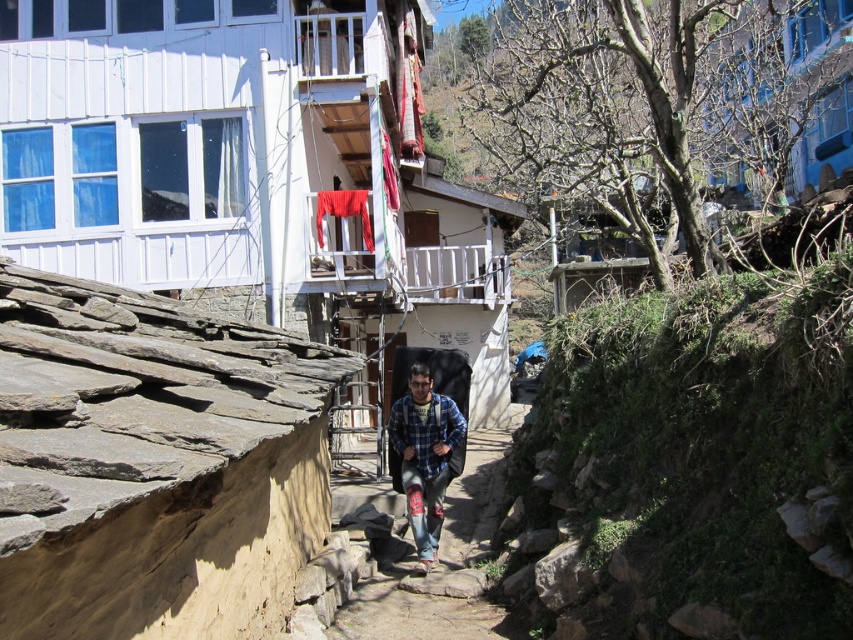
Question: Can you confirm if denim jeans at center is positioned to the right of blue plaid shirt at center?

Choices:
 (A) yes
 (B) no

Answer: (A)

Question: Does denim jeans at center have a larger size compared to blue plaid shirt at center?

Choices:
 (A) no
 (B) yes

Answer: (B)

Question: Which point is closer to the camera?

Choices:
 (A) denim jeans at center
 (B) blue plaid shirt at center

Answer: (A)

Question: Is denim jeans at center bigger than blue plaid shirt at center?

Choices:
 (A) no
 (B) yes

Answer: (B)